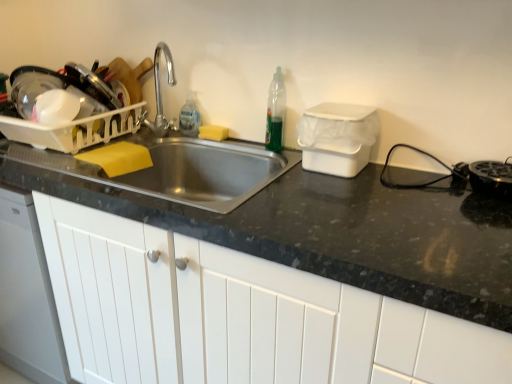
The height and width of the screenshot is (384, 512). Identify the location of vacant space to the left of translucent plastic bottle at sink, which is counted as the first bottle, starting from the back. (166, 132).